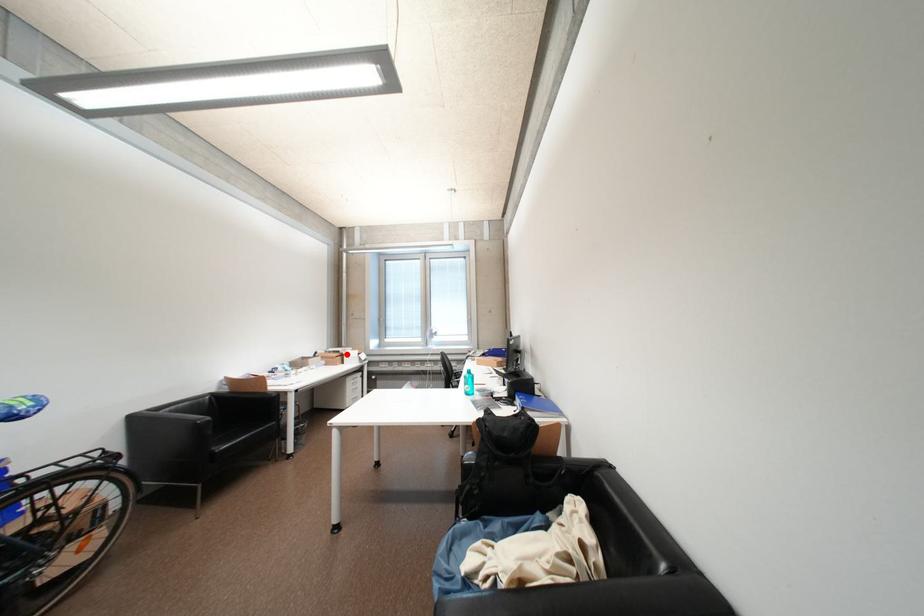
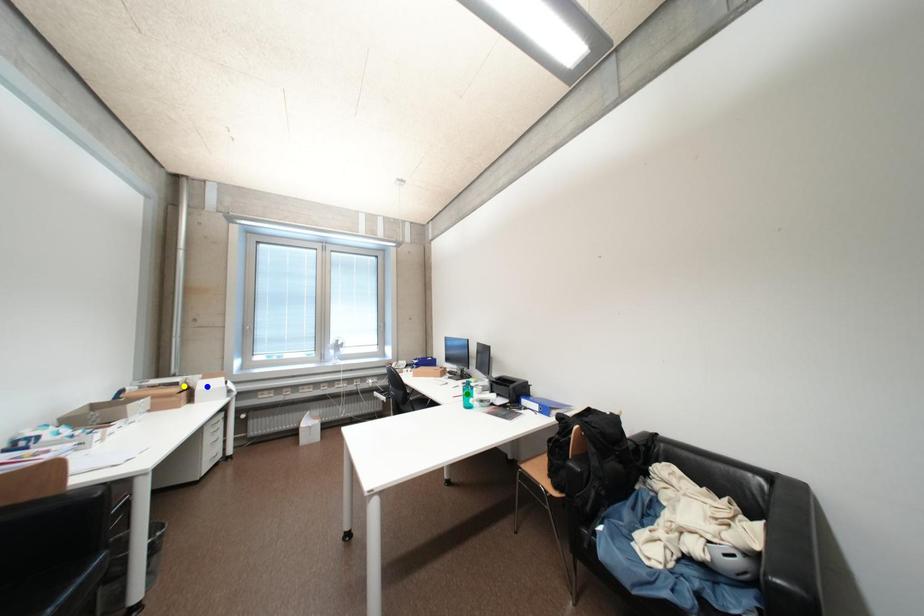
Question: I am providing you with two images of the same scene from different viewpoints. A red point is marked on the first image. You are given multiple points on the second image. Which spot in image 2 lines up with the point in image 1?

Choices:
 (A) blue point
 (B) yellow point
 (C) green point

Answer: (B)